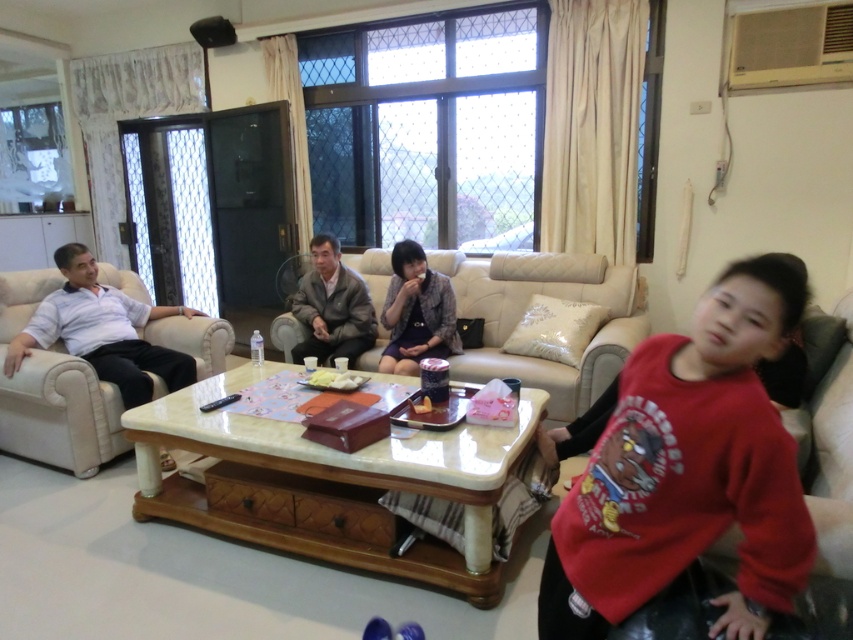
Is the position of beige quilted couch at center less distant than that of beige leather couch at left?

No.

Who is positioned more to the right, beige quilted couch at center or beige leather couch at left?

From the viewer's perspective, beige quilted couch at center appears more on the right side.

Between point (515, 298) and point (32, 369), which one is positioned in front?

Point (32, 369)

Identify the location of beige quilted couch at center. (525, 308).

From the picture: Does red cotton shirt at right come in front of dark gray fabric jacket at center?

Yes, red cotton shirt at right is closer to the viewer.

Between point (744, 400) and point (300, 355), which one is positioned behind?

Point (300, 355)

Image resolution: width=853 pixels, height=640 pixels. In order to click on red cotton shirt at right in this screenshot , I will do `click(686, 468)`.

Is point (631, 397) positioned behind point (125, 440)?

No.

Who is more distant from viewer, (743, 292) or (97, 433)?

The point (97, 433) is more distant.

This screenshot has width=853, height=640. What are the coordinates of `red cotton shirt at right` in the screenshot? It's located at (686, 468).